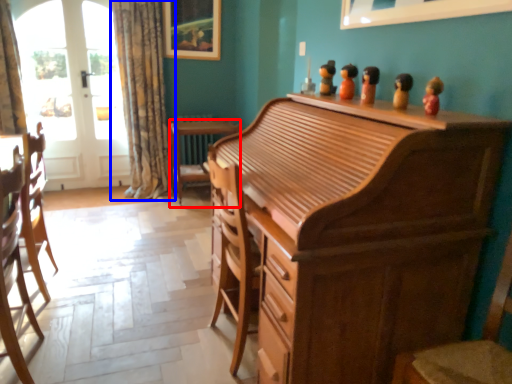
Question: Which object is further to the camera taking this photo, desk (highlighted by a red box) or curtain (highlighted by a blue box)?

Choices:
 (A) desk
 (B) curtain

Answer: (A)